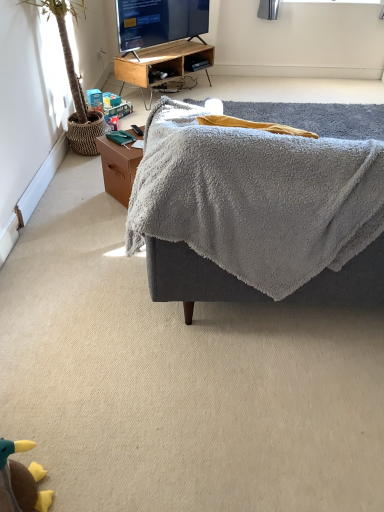
Question: Does gray fuzzy ottoman at center come in front of woodendesk at upper center?

Choices:
 (A) yes
 (B) no

Answer: (A)

Question: Can you confirm if gray fuzzy ottoman at center is thinner than woodendesk at upper center?

Choices:
 (A) yes
 (B) no

Answer: (B)

Question: Is gray fuzzy ottoman at center next to woodendesk at upper center and touching it?

Choices:
 (A) yes
 (B) no

Answer: (B)

Question: Is woodendesk at upper center completely or partially inside gray fuzzy ottoman at center?

Choices:
 (A) no
 (B) yes

Answer: (A)

Question: Is gray fuzzy ottoman at center positioned with its back to woodendesk at upper center?

Choices:
 (A) no
 (B) yes

Answer: (A)

Question: Is point (173, 11) closer or farther from the camera than point (117, 69)?

Choices:
 (A) farther
 (B) closer

Answer: (B)

Question: Considering the positions of matte black tv at upper center and woodendesk at upper center in the image, is matte black tv at upper center bigger or smaller than woodendesk at upper center?

Choices:
 (A) small
 (B) big

Answer: (A)

Question: Considering the positions of matte black tv at upper center and woodendesk at upper center in the image, is matte black tv at upper center taller or shorter than woodendesk at upper center?

Choices:
 (A) tall
 (B) short

Answer: (A)

Question: Is matte black tv at upper center to the left or to the right of woodendesk at upper center in the image?

Choices:
 (A) right
 (B) left

Answer: (B)

Question: Considering the positions of plush yellow duck at lower left and green leafy plant at left in the image, is plush yellow duck at lower left taller or shorter than green leafy plant at left?

Choices:
 (A) short
 (B) tall

Answer: (A)

Question: Considering their positions, is plush yellow duck at lower left located in front of or behind green leafy plant at left?

Choices:
 (A) behind
 (B) front

Answer: (B)

Question: Would you say plush yellow duck at lower left is inside or outside green leafy plant at left?

Choices:
 (A) inside
 (B) outside

Answer: (B)

Question: Looking at their shapes, would you say plush yellow duck at lower left is wider or thinner than green leafy plant at left?

Choices:
 (A) wide
 (B) thin

Answer: (B)

Question: Choose the correct answer: Is green leafy plant at left inside plush yellow duck at lower left or outside it?

Choices:
 (A) outside
 (B) inside

Answer: (A)

Question: From their relative heights in the image, would you say green leafy plant at left is taller or shorter than plush yellow duck at lower left?

Choices:
 (A) short
 (B) tall

Answer: (B)